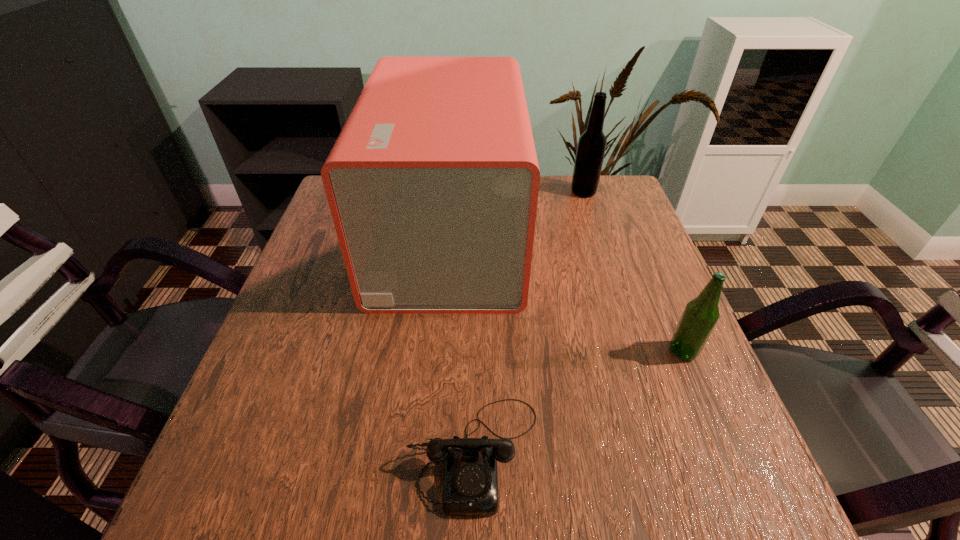
Identify the location of free space between the rightmost object and the box. (566, 294).

This screenshot has height=540, width=960. In order to click on unoccupied area between the second tallest object and the shortest object in this screenshot , I will do `click(529, 322)`.

At what (x,y) coordinates should I click in order to perform the action: click on free space between the nearest object and the third object from left to right. Please return your answer as a coordinate pair (x, y). Image resolution: width=960 pixels, height=540 pixels. Looking at the image, I should click on (529, 322).

You are a GUI agent. You are given a task and a screenshot of the screen. Output one action in this format:
    pyautogui.click(x=<x>, y=<y>)
    Task: Click on the empty space between the box and the nearer beer bottle
    
    Given the screenshot: What is the action you would take?
    pyautogui.click(x=566, y=294)

Select which object appears as the closest to the nearer beer bottle. Please provide its 2D coordinates. Your answer should be formatted as a tuple, i.e. [(x, y)], where the tuple contains the x and y coordinates of a point satisfying the conditions above.

[(433, 182)]

Identify the location of object that is the closest one to the tallest object. Image resolution: width=960 pixels, height=540 pixels. (591, 147).

I want to click on free spot that satisfies the following two spatial constraints: 1. on the front side of the second object from right to left; 2. on the surface of the tallest object where the text is embossed, so click(598, 237).